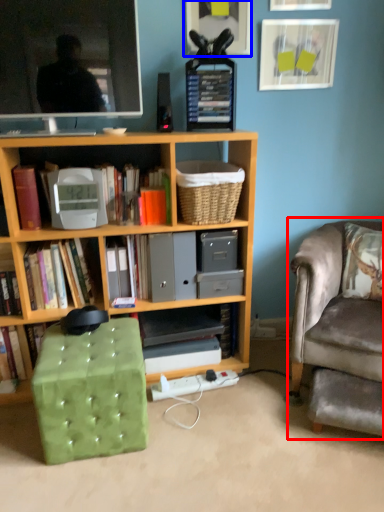
Question: Which object appears closest to the camera in this image, chair (highlighted by a red box) or picture frame (highlighted by a blue box)?

Choices:
 (A) chair
 (B) picture frame

Answer: (A)